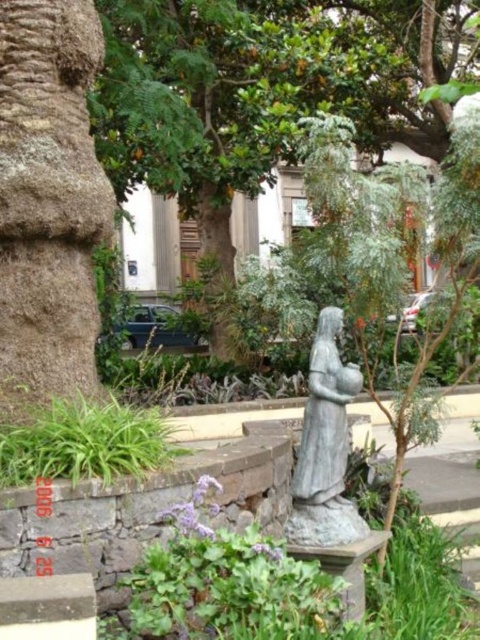
The width and height of the screenshot is (480, 640). What do you see at coordinates (84, 442) in the screenshot?
I see `green grass at lower left` at bounding box center [84, 442].

The width and height of the screenshot is (480, 640). What are the coordinates of `green grass at lower left` in the screenshot? It's located at (84, 442).